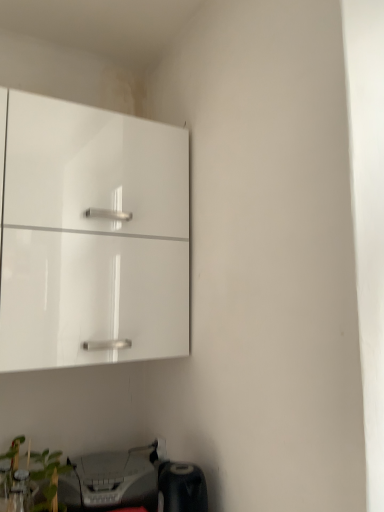
Where is `green leafy plant at lower left`? The width and height of the screenshot is (384, 512). green leafy plant at lower left is located at coordinates (48, 478).

I want to click on glossy white cabinet at upper left, so click(x=92, y=237).

Find the location of a particular element. The width and height of the screenshot is (384, 512). green leafy plant at lower left is located at coordinates (48, 478).

Considering the sizes of glossy white cabinet at upper left and matte gray printer at lower left in the image, is glossy white cabinet at upper left wider or thinner than matte gray printer at lower left?

Clearly, glossy white cabinet at upper left has more width compared to matte gray printer at lower left.

Find the location of a particular element. The width and height of the screenshot is (384, 512). cabinetry that appears above the matte gray printer at lower left (from the image's perspective) is located at coordinates (92, 237).

Is glossy white cabinet at upper left in front of matte gray printer at lower left?

Yes, glossy white cabinet at upper left is closer to the camera.

Is glossy white cabinet at upper left looking in the opposite direction of matte gray printer at lower left?

That's not correct — glossy white cabinet at upper left is not looking away from matte gray printer at lower left.

Would you consider green leafy plant at lower left to be distant from matte gray printer at lower left?

Actually, green leafy plant at lower left and matte gray printer at lower left are a little close together.

From a real-world perspective, is green leafy plant at lower left on top of matte gray printer at lower left?

Correct, in the physical world, green leafy plant at lower left is higher than matte gray printer at lower left.

Does point (43, 462) come closer to viewer compared to point (96, 508)?

That is False.

Between point (154, 456) and point (54, 172), which one is positioned in front?

The point (54, 172) is closer to the camera.

I want to click on printer behind the glossy white cabinet at upper left, so click(112, 480).

Could you tell me if matte gray printer at lower left is turned towards glossy white cabinet at upper left?

No, matte gray printer at lower left is not aimed at glossy white cabinet at upper left.

Looking at this image, from a real-world perspective, is matte gray printer at lower left under glossy white cabinet at upper left?

Correct, in the physical world, matte gray printer at lower left is lower than glossy white cabinet at upper left.

Considering the positions of objects glossy white cabinet at upper left and green leafy plant at lower left in the image provided, who is more to the right, glossy white cabinet at upper left or green leafy plant at lower left?

glossy white cabinet at upper left is more to the right.

From the image's perspective, which is above, glossy white cabinet at upper left or green leafy plant at lower left?

glossy white cabinet at upper left is shown above in the image.

Does point (145, 347) come in front of point (46, 485)?

That is True.

Does point (43, 471) lie behind point (130, 277)?

Yes, it is behind point (130, 277).

Considering the relative sizes of green leafy plant at lower left and glossy white cabinet at upper left in the image provided, is green leafy plant at lower left taller than glossy white cabinet at upper left?

No, green leafy plant at lower left is not taller than glossy white cabinet at upper left.

From the image's perspective, between green leafy plant at lower left and glossy white cabinet at upper left, which one is located above?

glossy white cabinet at upper left, from the image's perspective.

Based on the photo, is green leafy plant at lower left closer to the viewer compared to glossy white cabinet at upper left?

No, green leafy plant at lower left is behind glossy white cabinet at upper left.

Between matte gray printer at lower left and green leafy plant at lower left, which one appears on the left side from the viewer's perspective?

Positioned to the left is green leafy plant at lower left.

Can you confirm if matte gray printer at lower left is smaller than green leafy plant at lower left?

Actually, matte gray printer at lower left might be larger than green leafy plant at lower left.

Image resolution: width=384 pixels, height=512 pixels. I want to click on plant above the matte gray printer at lower left (from a real-world perspective), so click(48, 478).

Does matte gray printer at lower left have a lesser height compared to green leafy plant at lower left?

Yes.

Find the location of `cabinetry above the matte gray printer at lower left (from the image's perspective)`. cabinetry above the matte gray printer at lower left (from the image's perspective) is located at coordinates (92, 237).

Image resolution: width=384 pixels, height=512 pixels. In order to click on printer behind the green leafy plant at lower left in this screenshot , I will do `click(112, 480)`.

Estimate the real-world distances between objects in this image. Which object is further from glossy white cabinet at upper left, matte gray printer at lower left or green leafy plant at lower left?

Among the two, green leafy plant at lower left is located further to glossy white cabinet at upper left.

Estimate the real-world distances between objects in this image. Which object is further from matte gray printer at lower left, glossy white cabinet at upper left or green leafy plant at lower left?

glossy white cabinet at upper left lies further to matte gray printer at lower left than the other object.

From the image, which object appears to be nearer to green leafy plant at lower left, glossy white cabinet at upper left or matte gray printer at lower left?

matte gray printer at lower left is positioned closer to the anchor green leafy plant at lower left.

Which object lies nearer to the anchor point matte gray printer at lower left, green leafy plant at lower left or glossy white cabinet at upper left?

green leafy plant at lower left.

Based on their spatial positions, is green leafy plant at lower left or matte gray printer at lower left further from glossy white cabinet at upper left?

green leafy plant at lower left is positioned further to the anchor glossy white cabinet at upper left.

In the scene shown: From the image, which object appears to be farther from green leafy plant at lower left, matte gray printer at lower left or glossy white cabinet at upper left?

glossy white cabinet at upper left.

The height and width of the screenshot is (512, 384). Find the location of `plant between glossy white cabinet at upper left and matte gray printer at lower left in the up-down direction`. plant between glossy white cabinet at upper left and matte gray printer at lower left in the up-down direction is located at coordinates (48, 478).